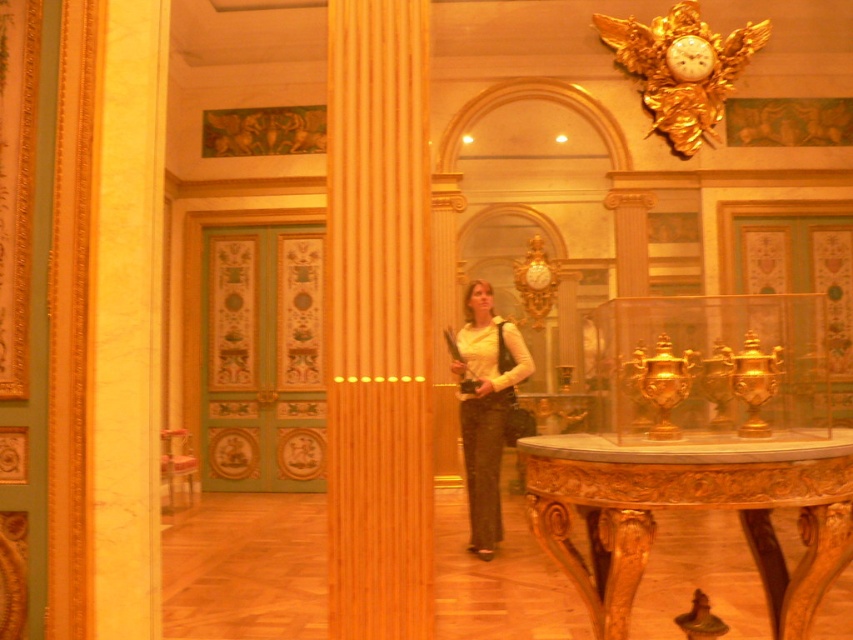
You are an interior designer planning to place a new sculpture in the center of the room. The sculpture requires a base that must be wider than the smooth wood pillar at center but narrower than the gold carved table at center. Is there a space available between these two objects to accommodate the sculpture?

The smooth wood pillar at center is thinner than the gold carved table at center, so there is a space between their widths that can accommodate a base wider than the pillar but narrower than the table.

You are a tour guide leading a group through this museum. You need to move from the gold carved table at center to the gold metallic clock at upper center to explain its historical significance. Can you walk directly between them without any obstacles?

The gold carved table at center and gold metallic clock at upper center are 6.77 meters apart from each other, so yes, you can walk directly between them without any obstacles as there is enough space between them.

You are an interior designer assessing the space between the gold carved table at center and the gold metallic clock at upper center. Which object takes up more space in the room?

The gold carved table at center is bigger than the gold metallic clock at upper center, so it occupies more space in the room.